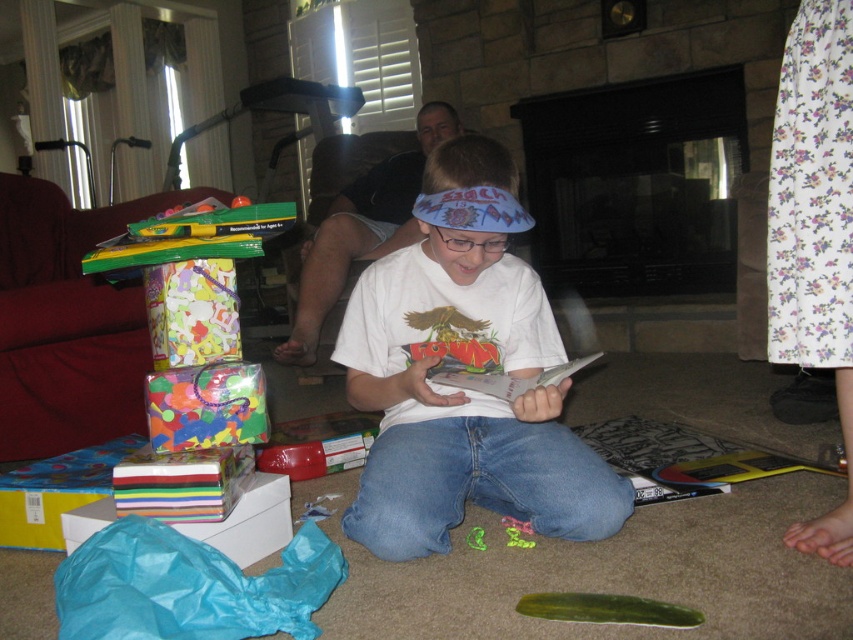
Question: Which object is positioned closest to the green smooth pickle at lower center?

Choices:
 (A) multicolored paper stack at lower left
 (B) white t-shirt at center
 (C) white paper book at center

Answer: (C)

Question: Estimate the real-world distances between objects in this image. Which object is farther from the green smooth pickle at lower center?

Choices:
 (A) white t-shirt at center
 (B) white paper book at center

Answer: (A)

Question: Does white t-shirt at center appear on the right side of green smooth pickle at lower center?

Choices:
 (A) no
 (B) yes

Answer: (A)

Question: Does white t-shirt at center have a greater width compared to multicolored paper stack at lower left?

Choices:
 (A) no
 (B) yes

Answer: (B)

Question: Estimate the real-world distances between objects in this image. Which object is closer to the white t-shirt at center?

Choices:
 (A) white paper book at center
 (B) green smooth pickle at lower center
 (C) multicolored paper stack at lower left

Answer: (A)

Question: Does white t-shirt at center appear on the left side of green smooth pickle at lower center?

Choices:
 (A) no
 (B) yes

Answer: (B)